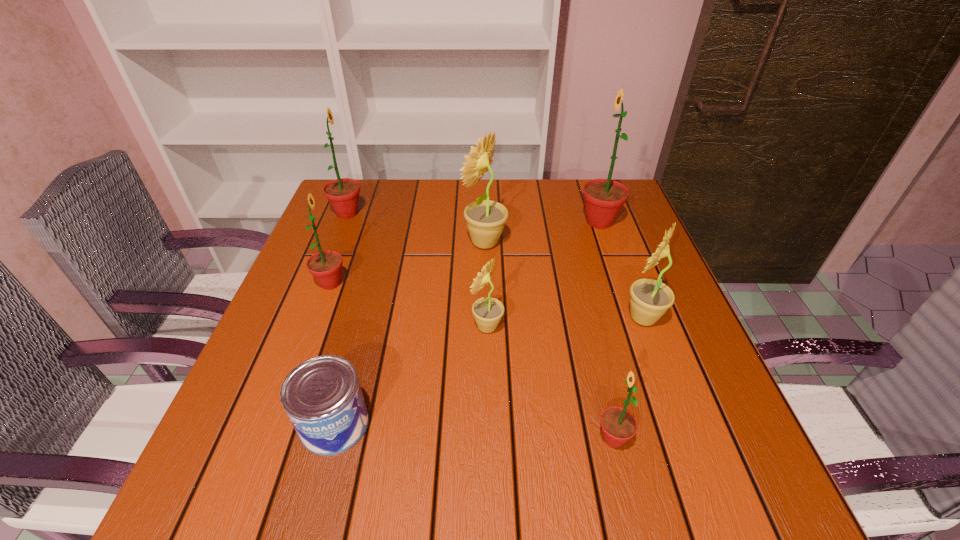
Choose which green sunflower is the nearest neighbor to the can. Please provide its 2D coordinates. Your answer should be formatted as a tuple, i.e. [(x, y)], where the tuple contains the x and y coordinates of a point satisfying the conditions above.

[(326, 266)]

The height and width of the screenshot is (540, 960). I want to click on green sunflower that is the third closest to the blue can, so click(x=342, y=193).

Locate which yellow sunflower is the closest to the shortest object. Please provide its 2D coordinates. Your answer should be formatted as a tuple, i.e. [(x, y)], where the tuple contains the x and y coordinates of a point satisfying the conditions above.

[(487, 311)]

Locate which yellow sunflower ranks in proximity to the tallest sunflower. Please provide its 2D coordinates. Your answer should be formatted as a tuple, i.e. [(x, y)], where the tuple contains the x and y coordinates of a point satisfying the conditions above.

[(486, 219)]

What are the coordinates of `free space that satisfies the following two spatial constraints: 1. on the face of the smallest yellow sunflower; 2. on the front label of the can` in the screenshot? It's located at (489, 424).

Where is `blank area in the image that satisfies the following two spatial constraints: 1. on the face of the biggest yellow sunflower; 2. on the front label of the shortest object`? The height and width of the screenshot is (540, 960). blank area in the image that satisfies the following two spatial constraints: 1. on the face of the biggest yellow sunflower; 2. on the front label of the shortest object is located at coordinates (488, 424).